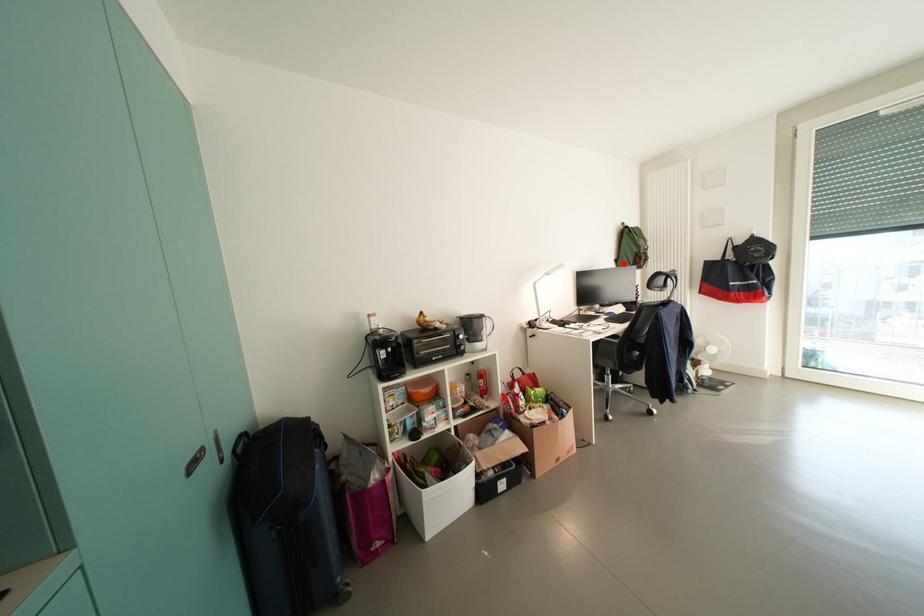
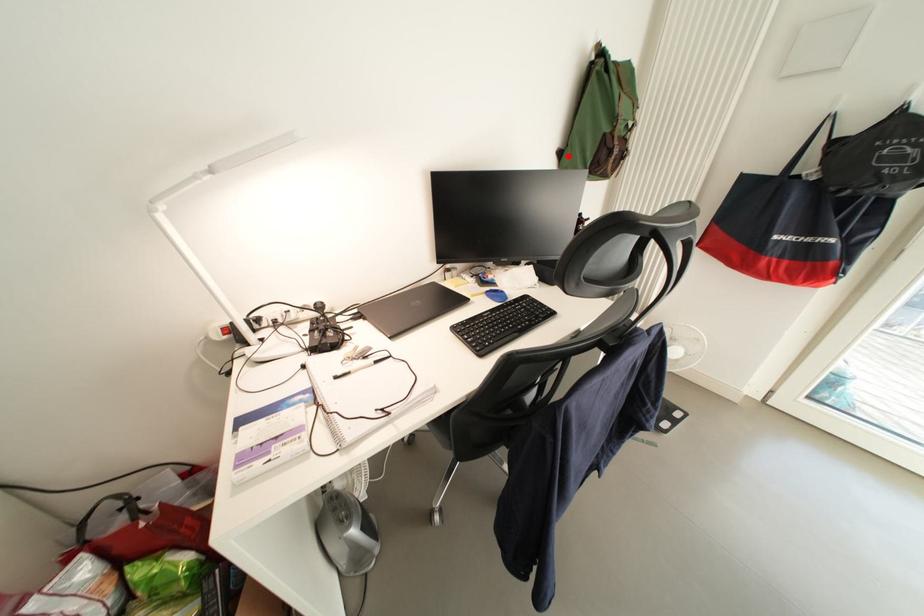
I am providing you with two images of the same scene from different viewpoints. A red point is marked on the first image and another point is marked on the second image. Does the point marked in image1 correspond to the same location as the one in image2?

Yes